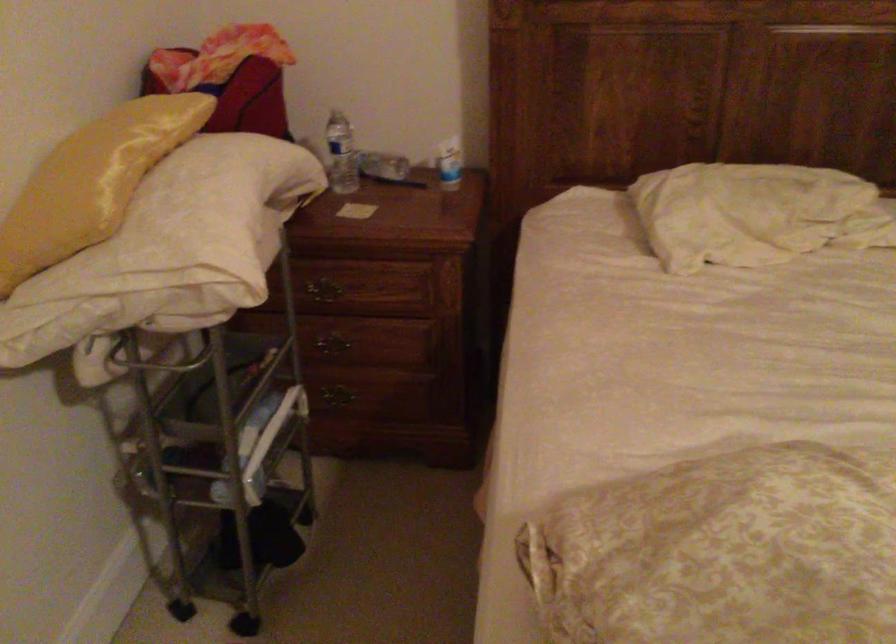
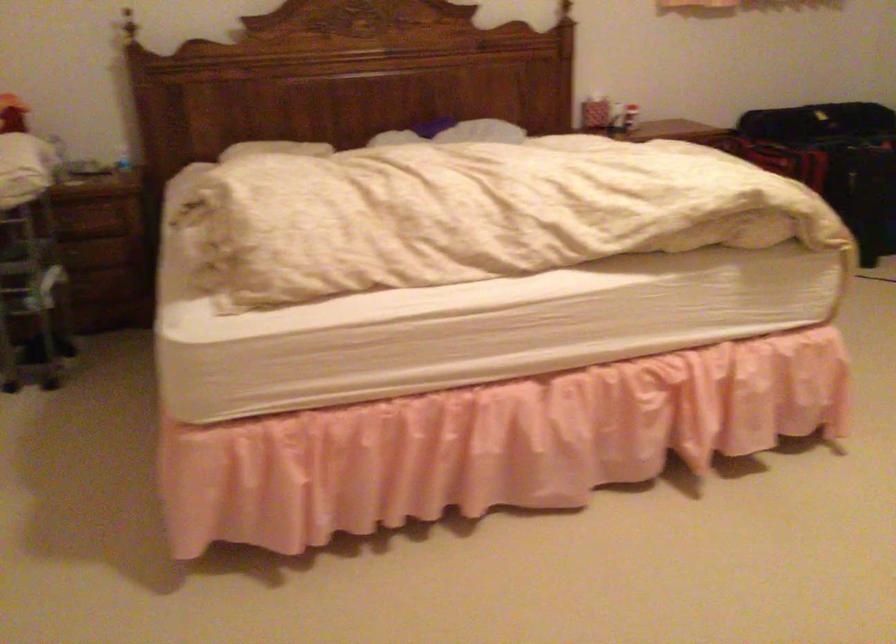
Question: What movement of the cameraman would produce the second image?

Choices:
 (A) Left
 (B) Right
 (C) Forward
 (D) Backward

Answer: (D)